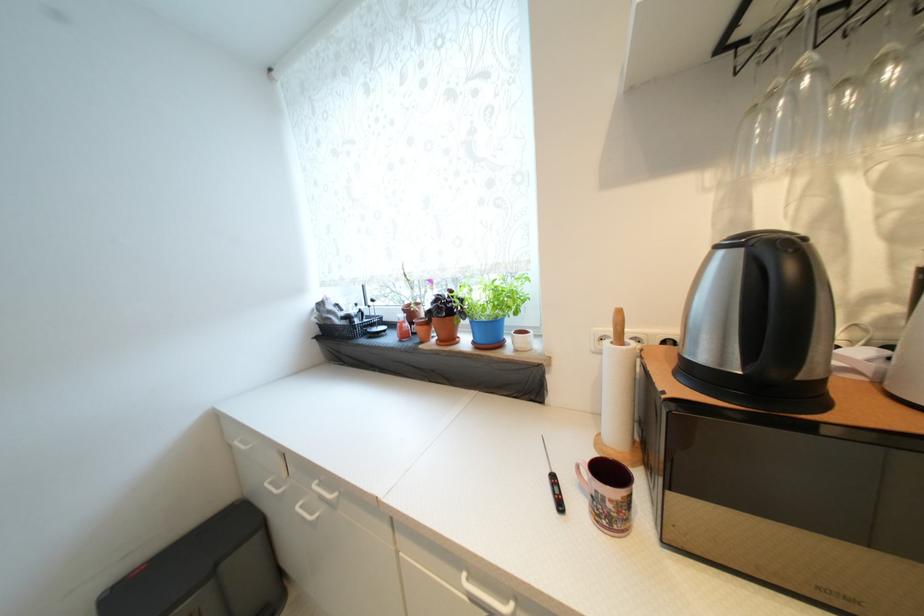
What do you see at coordinates (584, 479) in the screenshot?
I see `the patterned mug handle` at bounding box center [584, 479].